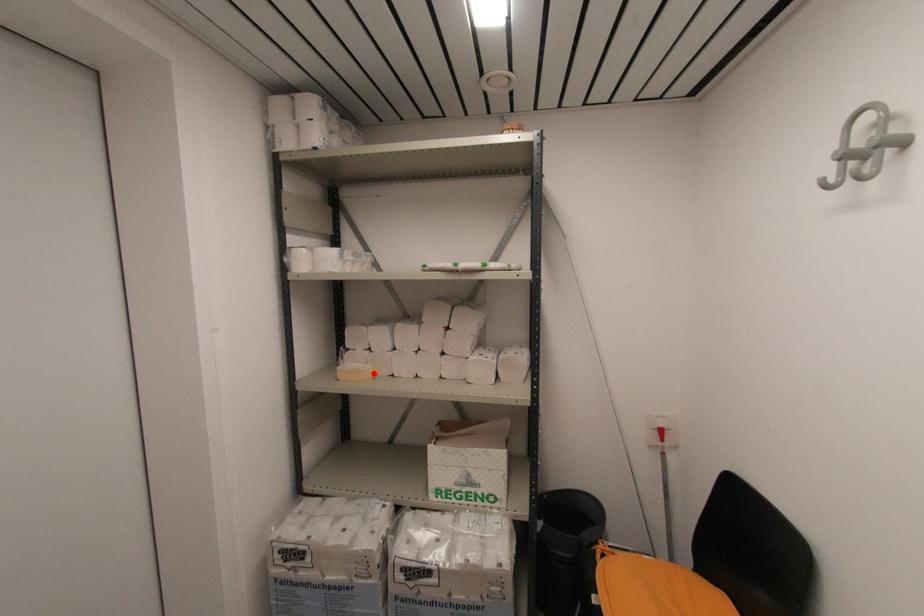
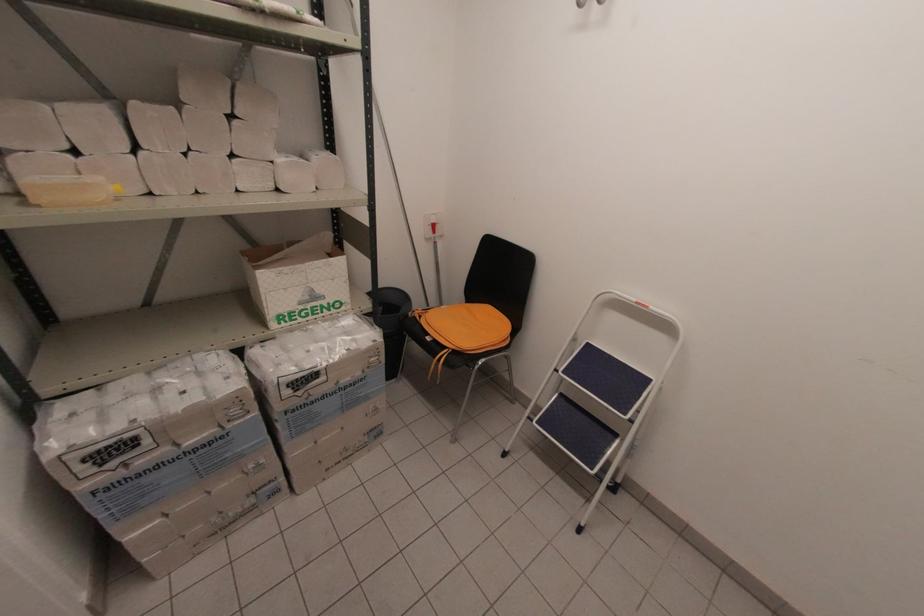
Locate, in the second image, the point that corresponds to the highlighted location in the first image.

(116, 188)